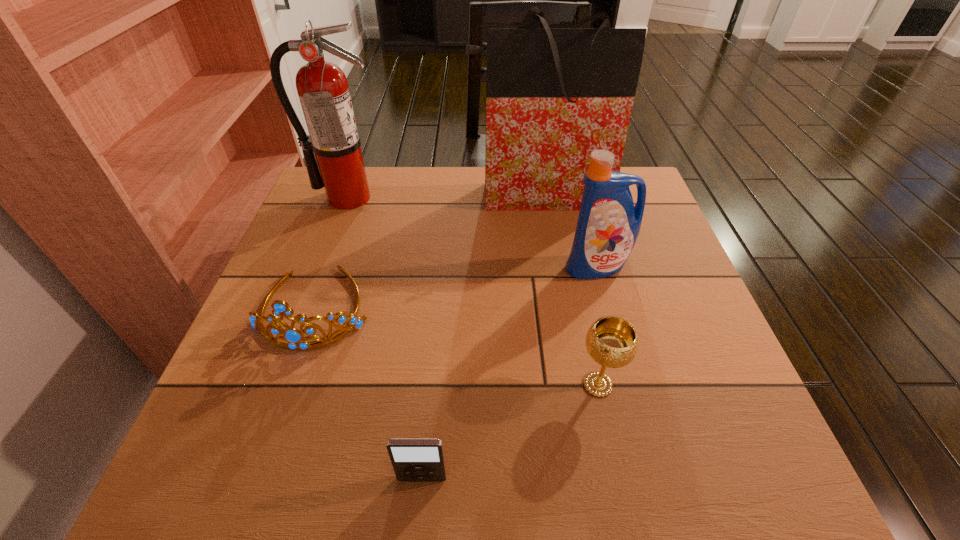
I want to click on object located in the far right corner section of the desktop, so click(x=553, y=95).

The width and height of the screenshot is (960, 540). What are the coordinates of `blank area at the far edge` in the screenshot? It's located at pyautogui.click(x=422, y=195).

This screenshot has height=540, width=960. In order to click on blank area at the near edge in this screenshot , I will do `click(386, 475)`.

Find the location of a particular element. The image size is (960, 540). vacant space at the left edge of the desktop is located at coordinates [272, 364].

This screenshot has height=540, width=960. Find the location of `vacant space at the right edge of the desktop`. vacant space at the right edge of the desktop is located at coordinates (687, 356).

Identify the location of vacant space at the far left corner of the desktop. The image size is (960, 540). (369, 183).

This screenshot has width=960, height=540. Find the location of `vacant space at the near left corner of the desktop`. vacant space at the near left corner of the desktop is located at coordinates (204, 468).

Where is `free space between the detergent and the shopping bag`? This screenshot has width=960, height=540. free space between the detergent and the shopping bag is located at coordinates (567, 231).

Find the location of `unoccupied area between the iPod and the chalice`. unoccupied area between the iPod and the chalice is located at coordinates (510, 431).

Where is `blank region between the tiara and the fourth shortest object`? This screenshot has width=960, height=540. blank region between the tiara and the fourth shortest object is located at coordinates (457, 287).